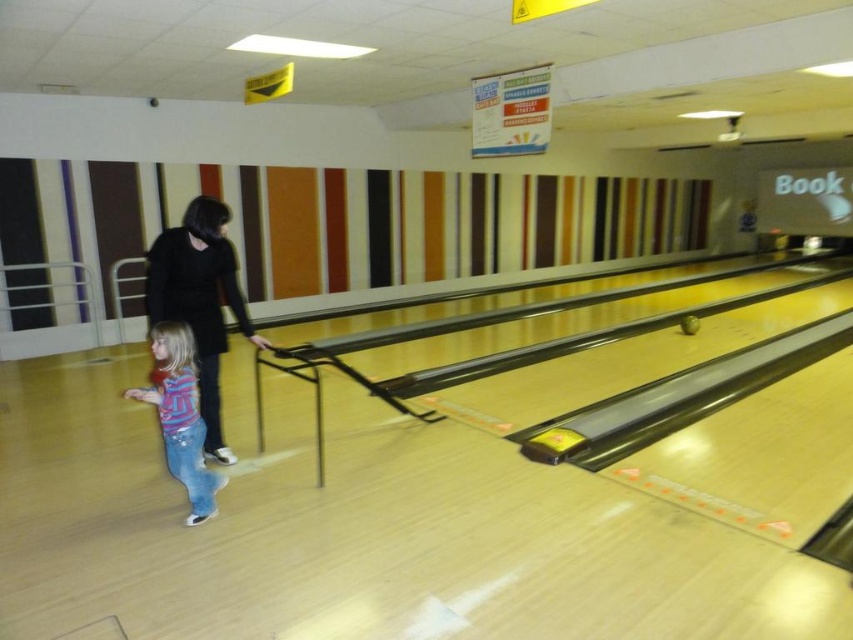
Question: Is black matte dress at center bigger than striped cotton shirt at lower left?

Choices:
 (A) yes
 (B) no

Answer: (A)

Question: Does black matte dress at center come in front of striped cotton shirt at lower left?

Choices:
 (A) no
 (B) yes

Answer: (A)

Question: Is black matte dress at center below striped cotton shirt at lower left?

Choices:
 (A) yes
 (B) no

Answer: (B)

Question: Which object is closer to the camera taking this photo?

Choices:
 (A) black matte dress at center
 (B) striped cotton shirt at lower left

Answer: (B)